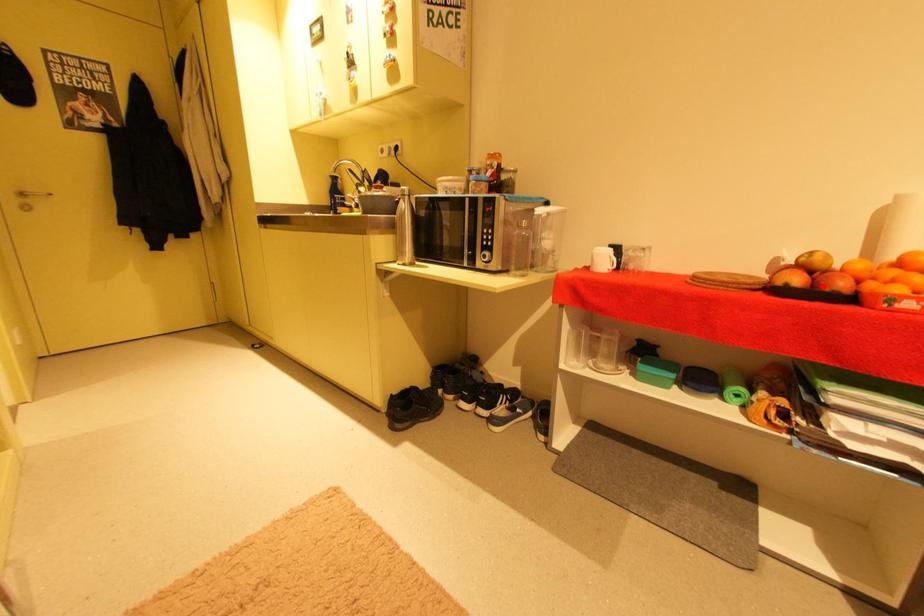
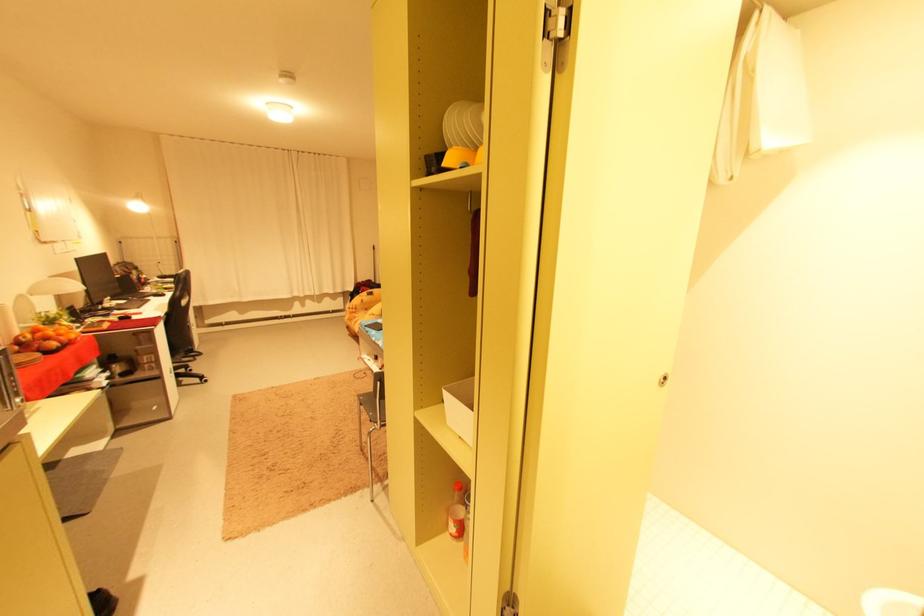
Find the pixel in the second image that matches the highlighted location in the first image.

(68, 344)